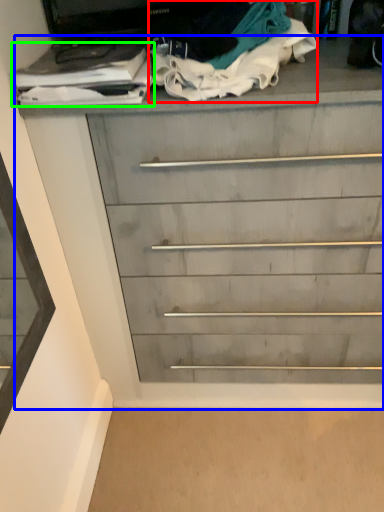
Question: Estimate the real-world distances between objects in this image. Which object is closer to clothing (highlighted by a red box), chest of drawers (highlighted by a blue box) or clothing (highlighted by a green box)?

Choices:
 (A) chest of drawers
 (B) clothing

Answer: (B)